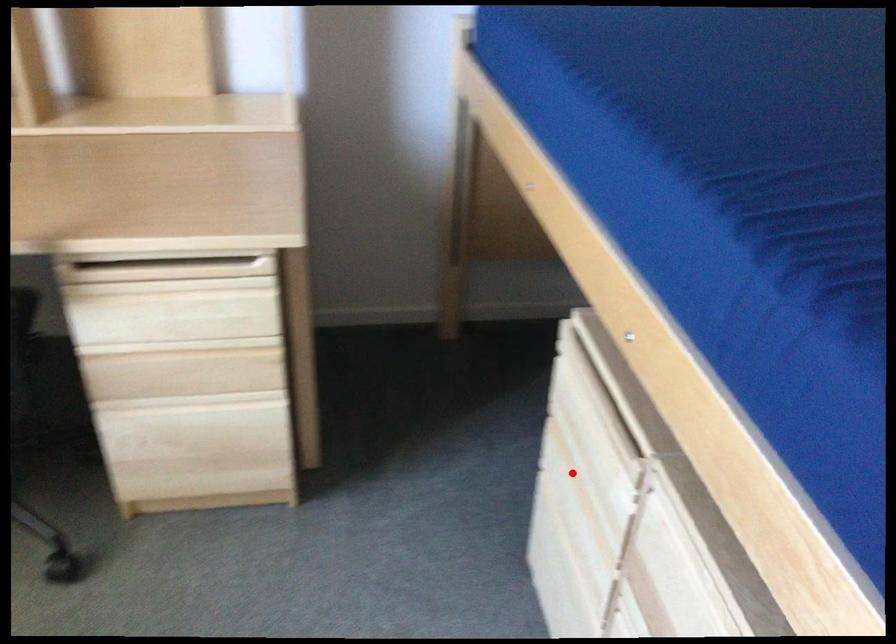
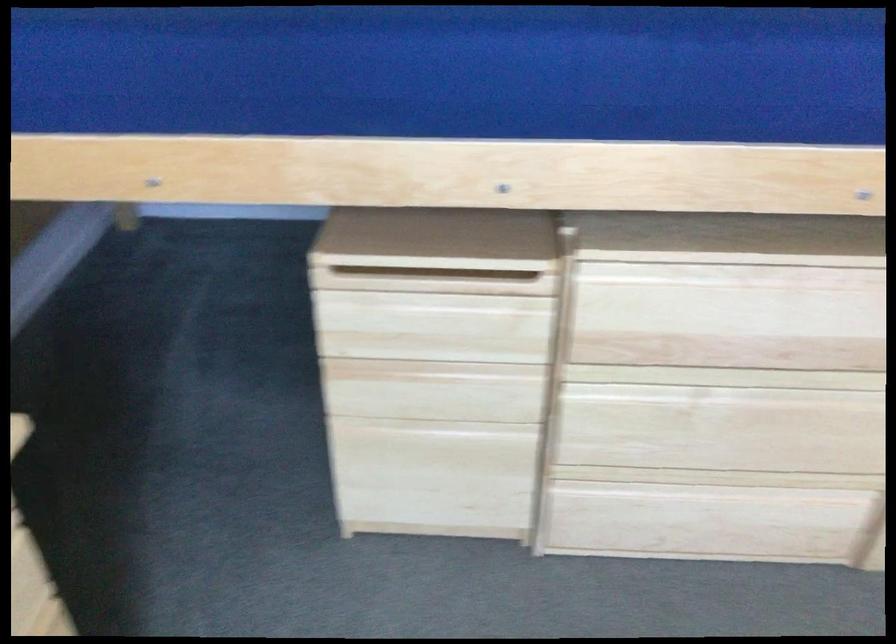
Find the pixel in the second image that matches the highlighted location in the first image.

(426, 371)